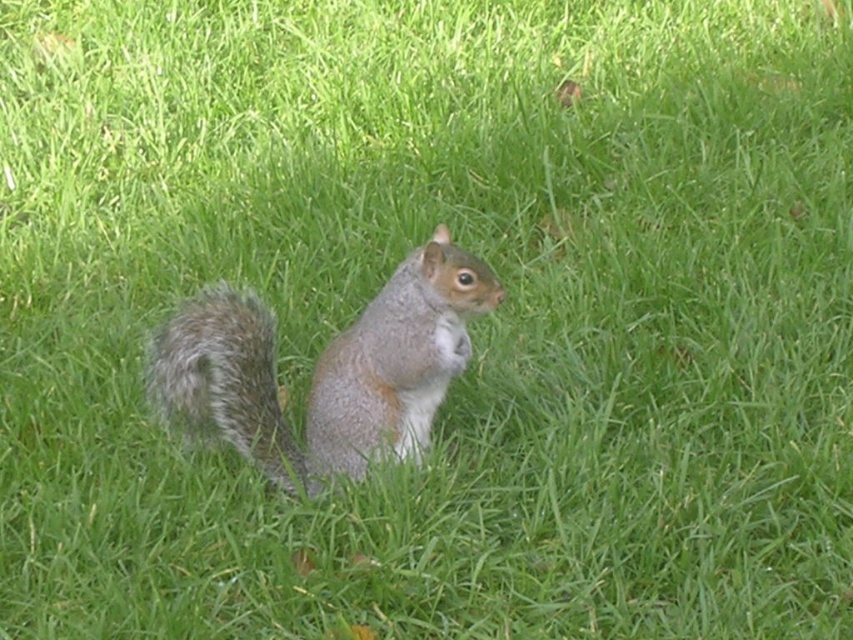
You are observing a squirrel in a park. There are two points marked in the image. The first point is at coordinates point (415, 323) and the second point is at point (250, 349). Which of these two points is closer to you?

Point (415, 323) is closer to the viewer than point (250, 349).

You are a photographer trying to capture the squirrel in the image. Since the gray furry squirrel at center is above the fuzzy gray tail at center, where should you focus your camera to ensure both are in the frame?

The gray furry squirrel at center is located above the fuzzy gray tail at center, so you should focus your camera on the area where the gray furry squirrel at center is positioned to include both in the frame.

You are a photographer trying to capture the gray furry squirrel at center and the fuzzy gray tail at center in a single shot. Since the squirrel is moving, you need to focus on the main subject first. Which one should you focus on to ensure the main subject is clear?

The gray furry squirrel at center is in front of the fuzzy gray tail at center, so you should focus on the gray furry squirrel at center first to ensure the main subject is clear.